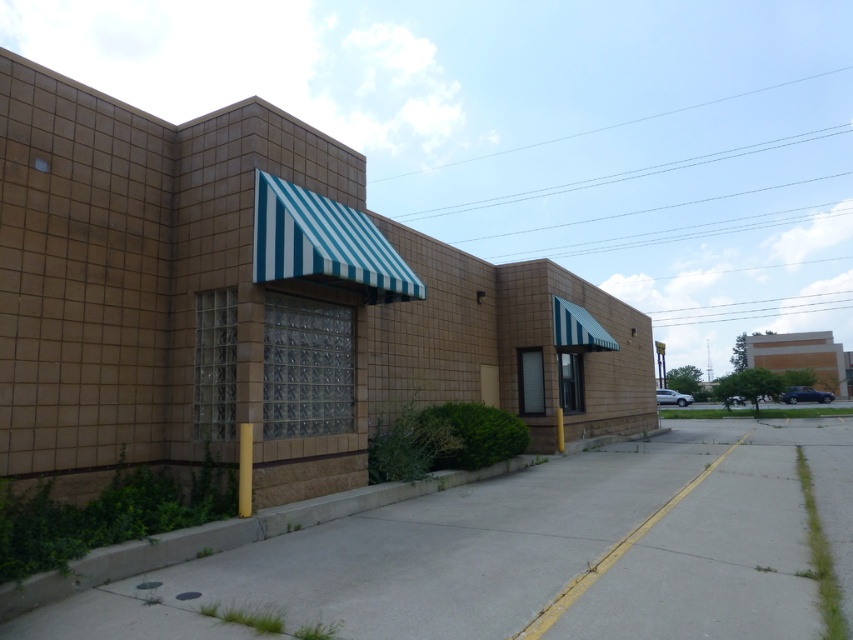
Can you confirm if brown tile building at center is taller than gray concrete pavement at lower center?

Yes.

Does brown tile building at center have a lesser height compared to gray concrete pavement at lower center?

No, brown tile building at center is not shorter than gray concrete pavement at lower center.

Is point (647, 356) less distant than point (775, 461)?

No, (647, 356) is behind (775, 461).

Identify the location of brown tile building at center. The image size is (853, 640). (258, 304).